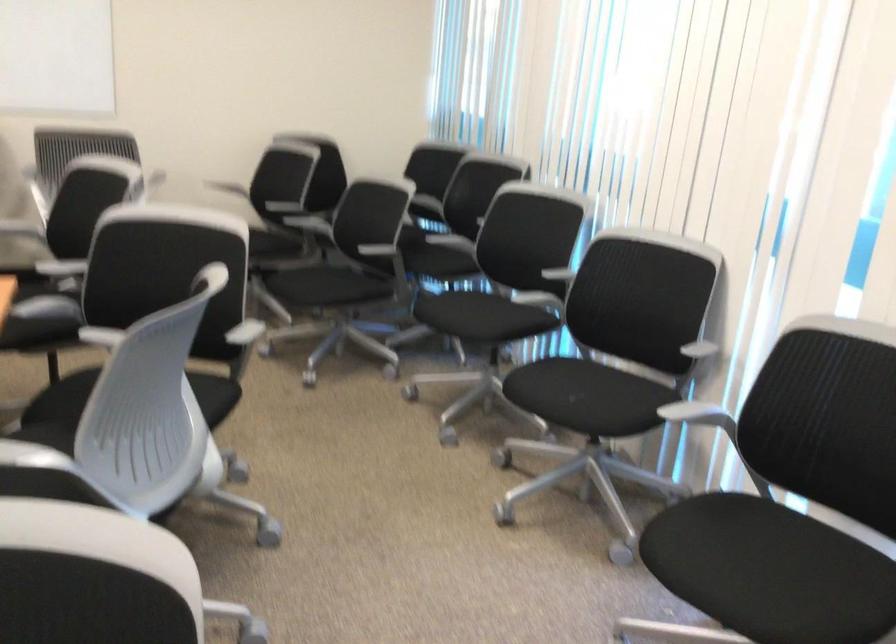
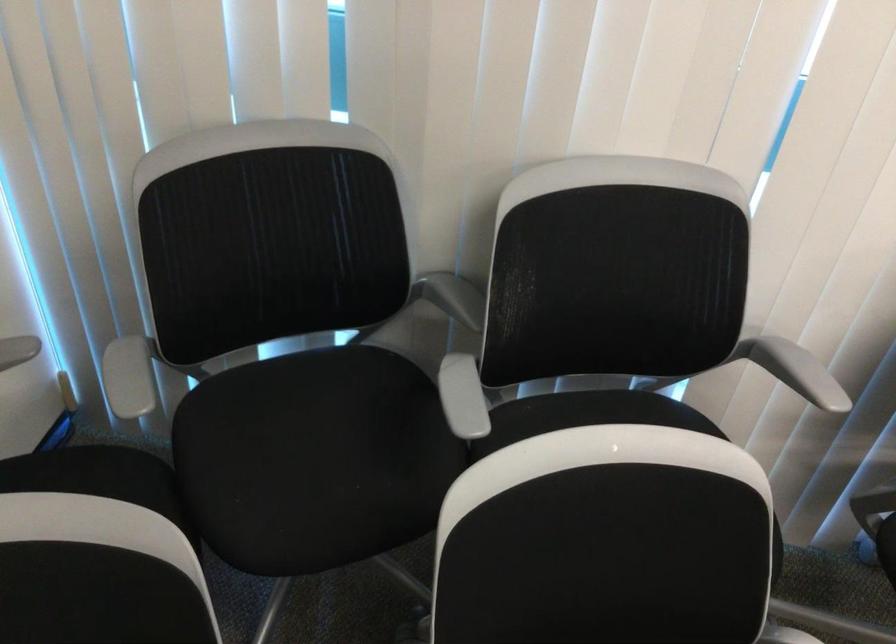
In the second image, find the point that corresponds to point (494, 219) in the first image.

(794, 370)